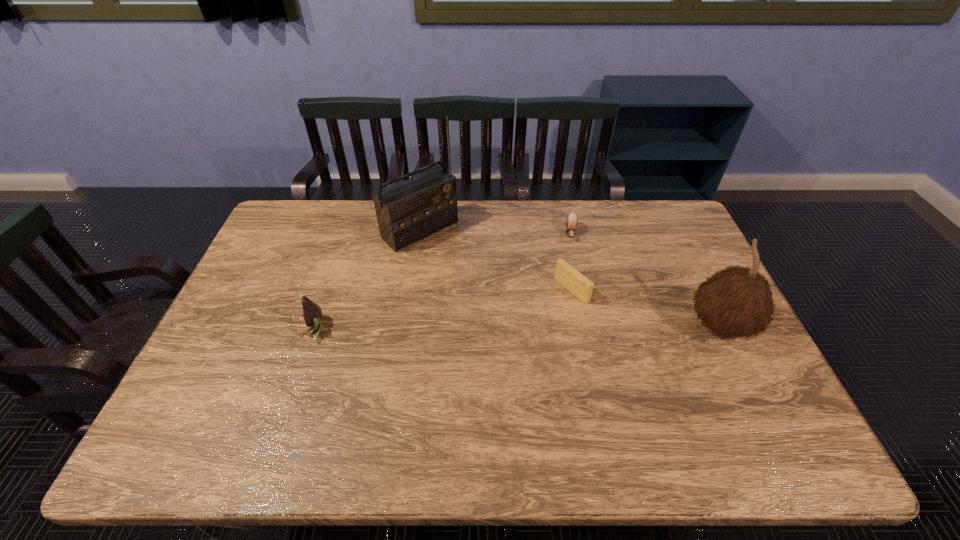
Find the location of a particular element. This screenshot has width=960, height=540. avocado is located at coordinates (312, 313).

Find the location of `the third tallest object`. the third tallest object is located at coordinates (312, 313).

In order to click on the rightmost object in this screenshot , I will do `click(737, 301)`.

The width and height of the screenshot is (960, 540). Find the location of `coconut`. coconut is located at coordinates (737, 301).

Where is `escargot`? escargot is located at coordinates (571, 221).

You are a GUI agent. You are given a task and a screenshot of the screen. Output one action in this format:
    pyautogui.click(x=<x>, y=<y>)
    Task: Click on the second object from left to right
    
    Given the screenshot: What is the action you would take?
    pyautogui.click(x=410, y=210)

You are a GUI agent. You are given a task and a screenshot of the screen. Output one action in this format:
    pyautogui.click(x=<x>, y=<y>)
    Task: Click on the radio receiver
    The image size is (960, 540).
    Given the screenshot: What is the action you would take?
    pyautogui.click(x=410, y=210)

Find the location of a particular element. videotape is located at coordinates (565, 274).

In order to click on free space located 0.090m on the seed side of the leftmost object in this screenshot , I will do `click(272, 329)`.

Identify the location of free space located 0.140m on the seed side of the leftmost object. The image size is (960, 540). (254, 329).